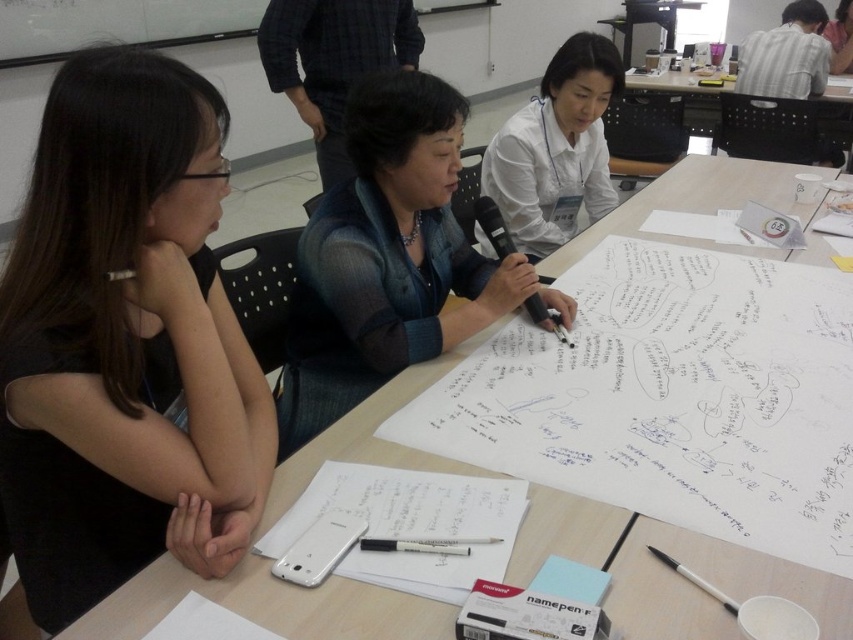
In the scene of the brainstorming session, there is a wooden table at center and a matte blue shirt at center. Which object is taller?

The matte blue shirt at center is taller than the wooden table at center.

You are standing in the room and want to reach both points. Which point, point (637, 582) or point (376, 544), is closer to you?

Point (637, 582) is closer to you than point (376, 544).

You are a participant in the brainstorming session and need to place a notebook on the wooden table at center. However, there is already a black marker pen at center on the table. Where should you place the notebook to avoid covering the marker pen?

The wooden table at center is positioned on the right side of the black marker pen at center, so you should place the notebook to the left of the black marker pen at center to avoid covering it.